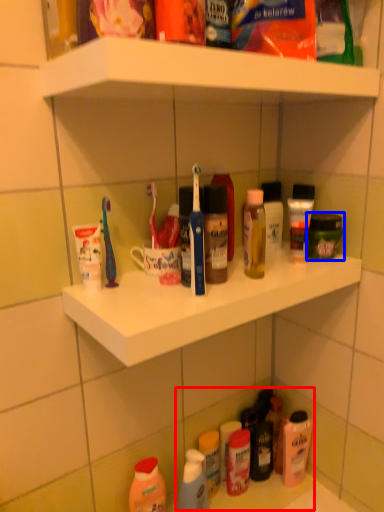
Question: Which point is further to the camera, product (highlighted by a red box) or toiletry (highlighted by a blue box)?

Choices:
 (A) product
 (B) toiletry

Answer: (A)